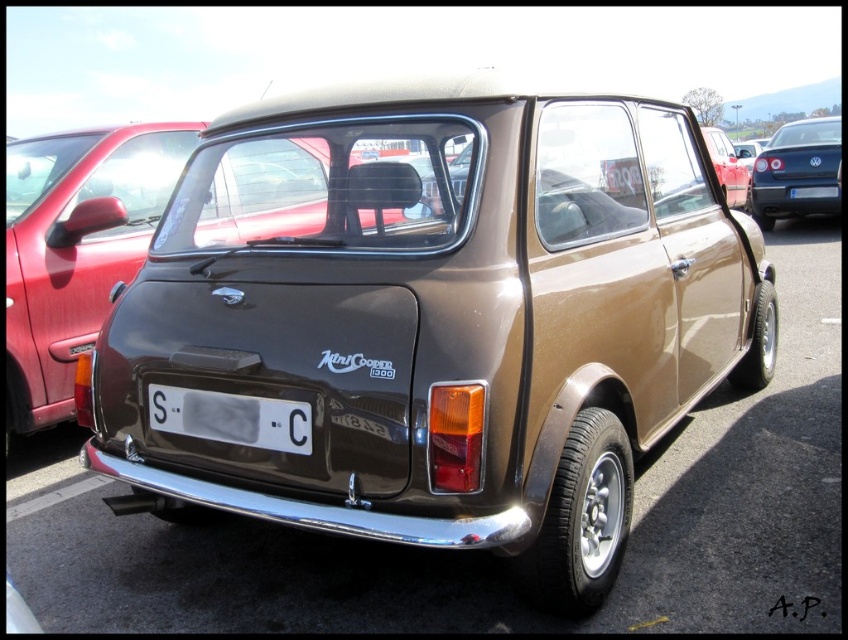
Is shiny blue sedan at upper right shorter than white plastic license plate at center?

In fact, shiny blue sedan at upper right may be taller than white plastic license plate at center.

Between point (817, 212) and point (171, 412), which one is positioned behind?

The point (817, 212) is behind.

Where is `shiny blue sedan at upper right`? This screenshot has height=640, width=848. shiny blue sedan at upper right is located at coordinates (796, 172).

Does shiny brown car at center have a lesser width compared to shiny blue sedan at upper right?

Incorrect, shiny brown car at center's width is not less than shiny blue sedan at upper right's.

Can you confirm if shiny brown car at center is taller than shiny blue sedan at upper right?

Indeed, shiny brown car at center has a greater height compared to shiny blue sedan at upper right.

Between point (25, 417) and point (802, 195), which one is positioned behind?

Point (802, 195)

The image size is (848, 640). I want to click on shiny brown car at center, so click(x=76, y=248).

Does shiny brown car at center appear on the left side of white plastic license plate at center?

Indeed, shiny brown car at center is positioned on the left side of white plastic license plate at center.

Find the location of a particular element. shiny brown car at center is located at coordinates (76, 248).

The height and width of the screenshot is (640, 848). What do you see at coordinates (76, 248) in the screenshot? I see `shiny brown car at center` at bounding box center [76, 248].

Find the location of a particular element. This screenshot has width=848, height=640. shiny brown car at center is located at coordinates (76, 248).